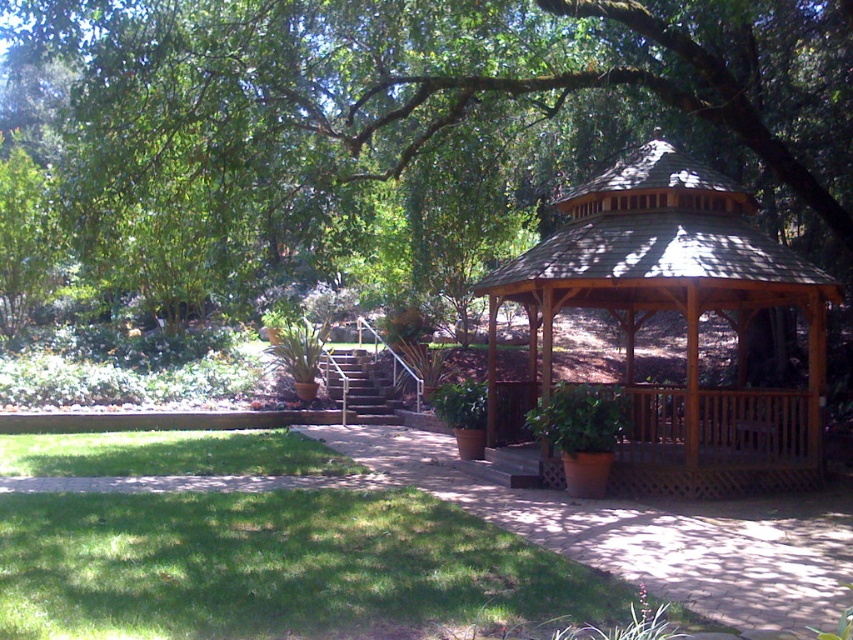
What do you see at coordinates (685, 324) in the screenshot?
I see `wooden gazebo at center` at bounding box center [685, 324].

Between wooden gazebo at center and brown wooden path at center, which one has more height?

Standing taller between the two is wooden gazebo at center.

This screenshot has height=640, width=853. Find the location of `wooden gazebo at center`. wooden gazebo at center is located at coordinates (685, 324).

Locate an element on the screen. This screenshot has height=640, width=853. green leafy tree at center is located at coordinates tap(403, 129).

Which of these two, green leafy tree at center or wooden gazebo at center, stands taller?

With more height is green leafy tree at center.

The width and height of the screenshot is (853, 640). What do you see at coordinates (403, 129) in the screenshot?
I see `green leafy tree at center` at bounding box center [403, 129].

Identify the location of green leafy tree at center. (403, 129).

Is green leafy tree at center taller than brown wooden path at center?

Yes.

Between point (347, 19) and point (505, 520), which one is positioned behind?

The point (347, 19) is behind.

Is point (329, 64) farther from camera compared to point (804, 620)?

Yes, point (329, 64) is farther from viewer.

Where is `green leafy tree at center`? green leafy tree at center is located at coordinates (403, 129).